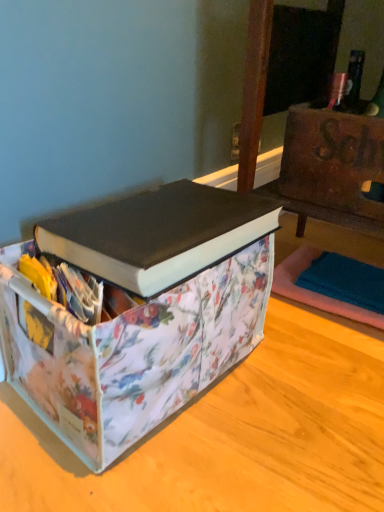
Measure the distance between black matte book at center and camera.

black matte book at center is 49.06 centimeters away from camera.

Find the location of a particular element. The height and width of the screenshot is (512, 384). black matte book at center is located at coordinates (158, 234).

What do you see at coordinates (158, 234) in the screenshot?
I see `black matte book at center` at bounding box center [158, 234].

Locate an element on the screen. The height and width of the screenshot is (512, 384). floral fabric storage bin at center is located at coordinates pos(139,312).

This screenshot has height=512, width=384. What do you see at coordinates (139, 312) in the screenshot?
I see `floral fabric storage bin at center` at bounding box center [139, 312].

Locate an element on the screen. black matte book at center is located at coordinates (158, 234).

Between floral fabric storage bin at center and black matte book at center, which one appears on the left side from the viewer's perspective?

Positioned to the left is floral fabric storage bin at center.

Between floral fabric storage bin at center and black matte book at center, which one is positioned in front?

floral fabric storage bin at center is closer to the camera.

Which is farther from the camera, (247, 203) or (121, 274)?

The point (247, 203) is more distant.

From the image's perspective, is floral fabric storage bin at center above or below black matte book at center?

From the image's perspective, floral fabric storage bin at center appears below black matte book at center.

From the picture: From a real-world perspective, does floral fabric storage bin at center stand above black matte book at center?

Actually, floral fabric storage bin at center is physically below black matte book at center in the real world.

Between floral fabric storage bin at center and black matte book at center, which one has smaller width?

black matte book at center is thinner.

Is floral fabric storage bin at center taller or shorter than black matte book at center?

In the image, floral fabric storage bin at center appears to be taller than black matte book at center.

Considering the sizes of objects floral fabric storage bin at center and black matte book at center in the image provided, who is bigger, floral fabric storage bin at center or black matte book at center?

With larger size is floral fabric storage bin at center.

Choose the correct answer: Is floral fabric storage bin at center inside black matte book at center or outside it?

floral fabric storage bin at center exists outside the volume of black matte book at center.

Can you see floral fabric storage bin at center touching black matte book at center?

Yes, the surface of floral fabric storage bin at center is in contact with black matte book at center.

Is floral fabric storage bin at center oriented towards black matte book at center?

No, floral fabric storage bin at center does not turn towards black matte book at center.

You are a GUI agent. You are given a task and a screenshot of the screen. Output one action in this format:
    pyautogui.click(x=<x>, y=<y>)
    Task: Click on the box located below the black matte book at center (from the image's perspective)
    The width and height of the screenshot is (384, 512).
    Given the screenshot: What is the action you would take?
    pyautogui.click(x=139, y=312)

Can you confirm if black matte book at center is positioned to the right of floral fabric storage bin at center?

Yes.

Is black matte book at center in front of or behind floral fabric storage bin at center in the image?

black matte book at center is positioned farther from the viewer than floral fabric storage bin at center.

Considering the points (192, 241) and (159, 423), which point is behind, point (192, 241) or point (159, 423)?

Point (159, 423)

From the image's perspective, which object appears higher, black matte book at center or floral fabric storage bin at center?

black matte book at center is shown above in the image.

From a real-world perspective, who is located lower, black matte book at center or floral fabric storage bin at center?

floral fabric storage bin at center, from a real-world perspective.

Which of these two, black matte book at center or floral fabric storage bin at center, is wider?

floral fabric storage bin at center.

Considering the relative sizes of black matte book at center and floral fabric storage bin at center in the image provided, is black matte book at center shorter than floral fabric storage bin at center?

Yes.

Is black matte book at center bigger than floral fabric storage bin at center?

No, black matte book at center is not bigger than floral fabric storage bin at center.

In the scene shown: Could floral fabric storage bin at center be considered to be inside black matte book at center?

No, floral fabric storage bin at center is located outside of black matte book at center.

Is black matte book at center not near floral fabric storage bin at center?

They are positioned close to each other.

From the picture: Does black matte book at center turn towards floral fabric storage bin at center?

No, black matte book at center is not aimed at floral fabric storage bin at center.

How many degrees apart are the facing directions of black matte book at center and floral fabric storage bin at center?

The facing directions of black matte book at center and floral fabric storage bin at center are 0.0177 degrees apart.

Measure the distance from black matte book at center to floral fabric storage bin at center.

They are 2.20 inches apart.

This screenshot has width=384, height=512. In order to click on book that appears on the right of floral fabric storage bin at center in this screenshot , I will do `click(158, 234)`.

This screenshot has width=384, height=512. What are the coordinates of `box on the left of black matte book at center` in the screenshot? It's located at (139, 312).

Where is `box below the black matte book at center (from a real-world perspective)`? This screenshot has height=512, width=384. box below the black matte book at center (from a real-world perspective) is located at coordinates (139, 312).